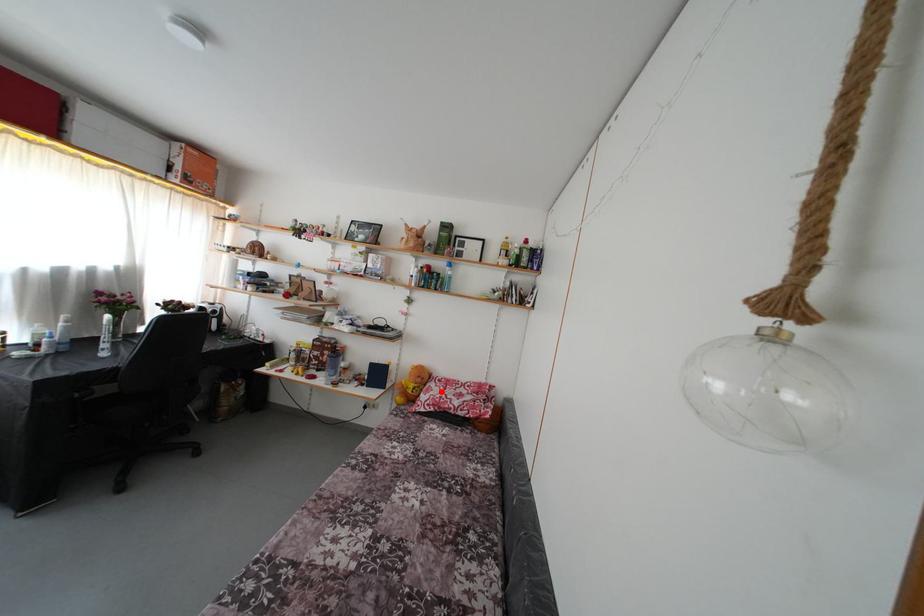
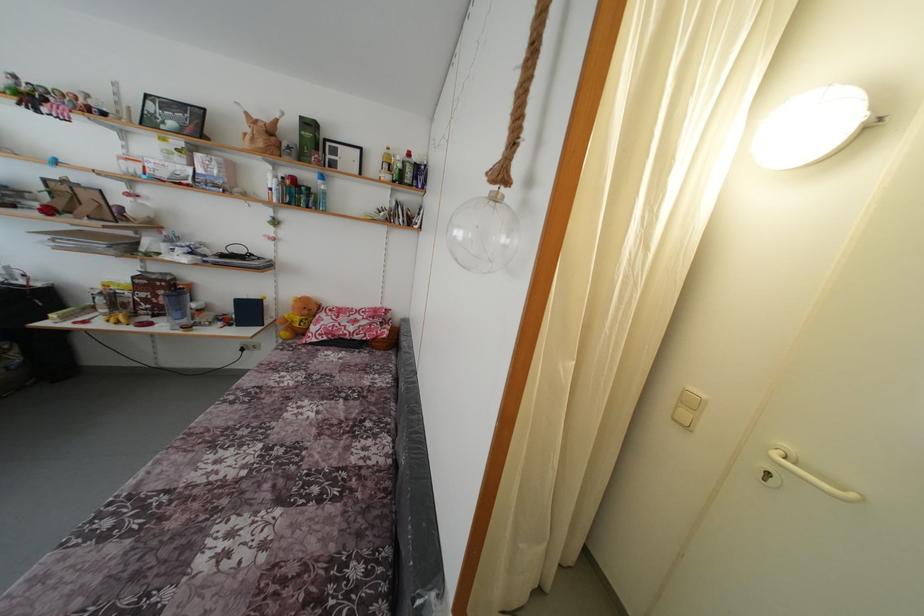
Question: I am providing you with two images of the same scene from different viewpoints. Image1 has a red point marked. In image2, the corresponding 3D location appears at what relative position? Reply with the corresponding letter.

Choices:
 (A) Closer
 (B) Farther

Answer: (A)